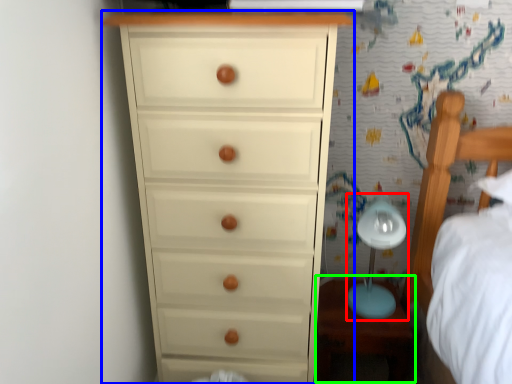
Question: Based on their relative distances, which object is nearer to table lamp (highlighted by a red box)? Choose from chest of drawers (highlighted by a blue box) and table (highlighted by a green box).

Choices:
 (A) chest of drawers
 (B) table

Answer: (B)